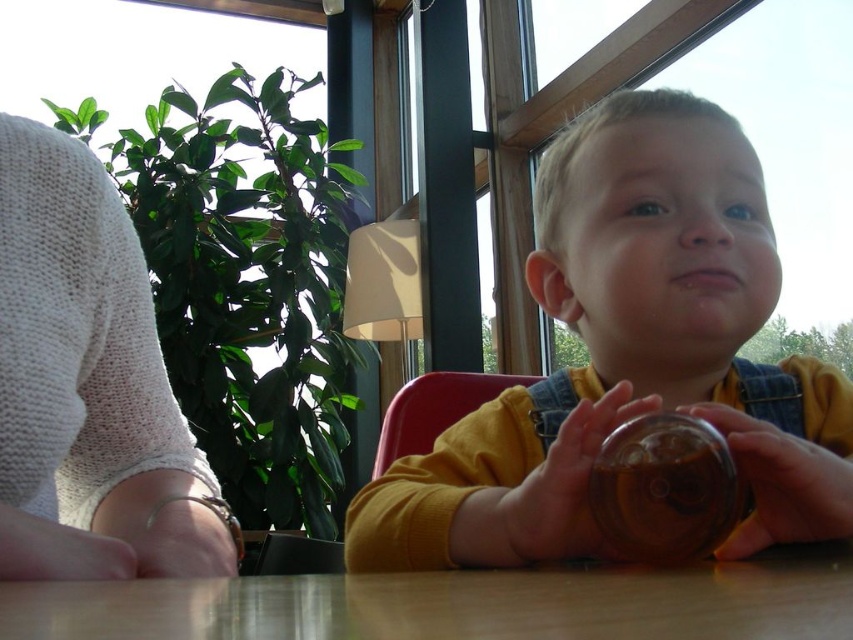
Which object is the point at location [781,483] located on?

The point at location [781,483] is on the translucent glass cup at center.

You are a customer at the cafe and want to grab the translucent glass cup at center to drink. However, there is another translucent plastic cup at center in the way. Can you reach the glass cup without moving the plastic cup?

The translucent glass cup at center is closer to the viewer than the translucent plastic cup at center, so you can reach the glass cup without moving the plastic cup since it is nearer to you.